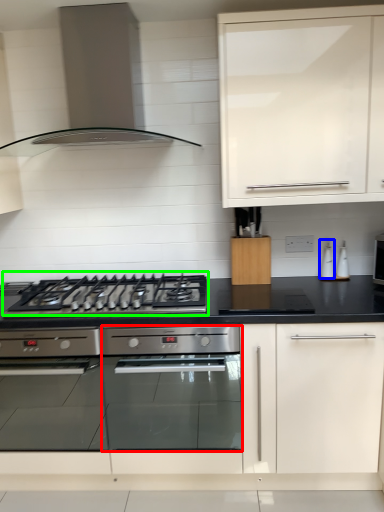
Question: Which object is the closest to the oven (highlighted by a red box)? Choose among these: appliance (highlighted by a blue box) or gas stove (highlighted by a green box).

Choices:
 (A) appliance
 (B) gas stove

Answer: (B)